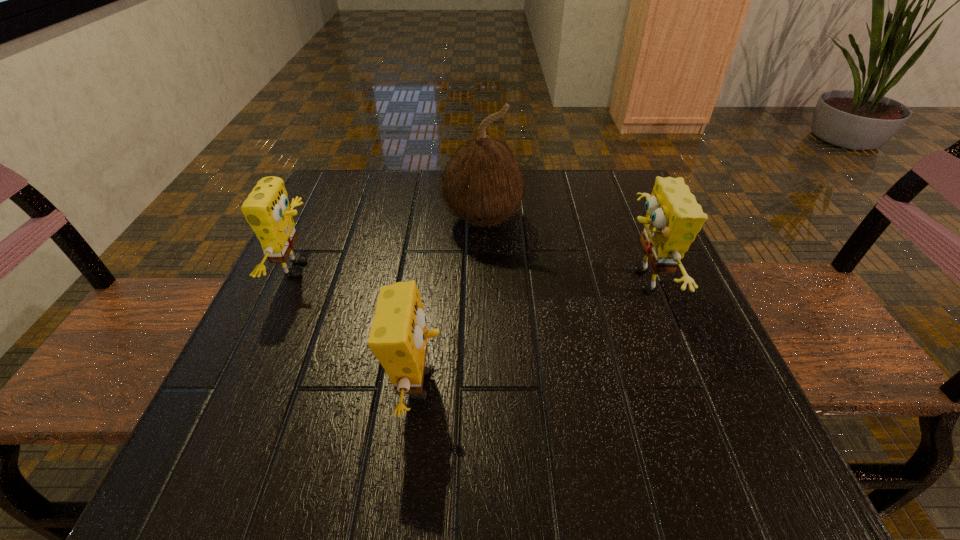
Find the location of a particular element. object at the far edge is located at coordinates (483, 184).

Locate an element on the screen. object that is at the near edge is located at coordinates (398, 337).

This screenshot has width=960, height=540. What are the coordinates of `object that is at the left edge` in the screenshot? It's located at (266, 209).

I want to click on object present at the right edge, so click(x=673, y=219).

Where is `vacant space at the far edge`? The image size is (960, 540). vacant space at the far edge is located at coordinates (535, 204).

Locate an element on the screen. The image size is (960, 540). vacant position at the near edge of the desktop is located at coordinates (601, 428).

I want to click on vacant space at the left edge, so click(x=305, y=337).

Identify the location of vacant space at the right edge of the desktop. The height and width of the screenshot is (540, 960). (617, 266).

You are a GUI agent. You are given a task and a screenshot of the screen. Output one action in this format:
    pyautogui.click(x=<x>, y=<y>)
    Task: Click on the vacant space at the far left corner of the desktop
    Image resolution: width=960 pixels, height=540 pixels.
    Given the screenshot: What is the action you would take?
    pyautogui.click(x=319, y=212)

The width and height of the screenshot is (960, 540). Find the location of `vacant space at the far right corner of the desktop`. vacant space at the far right corner of the desktop is located at coordinates (594, 189).